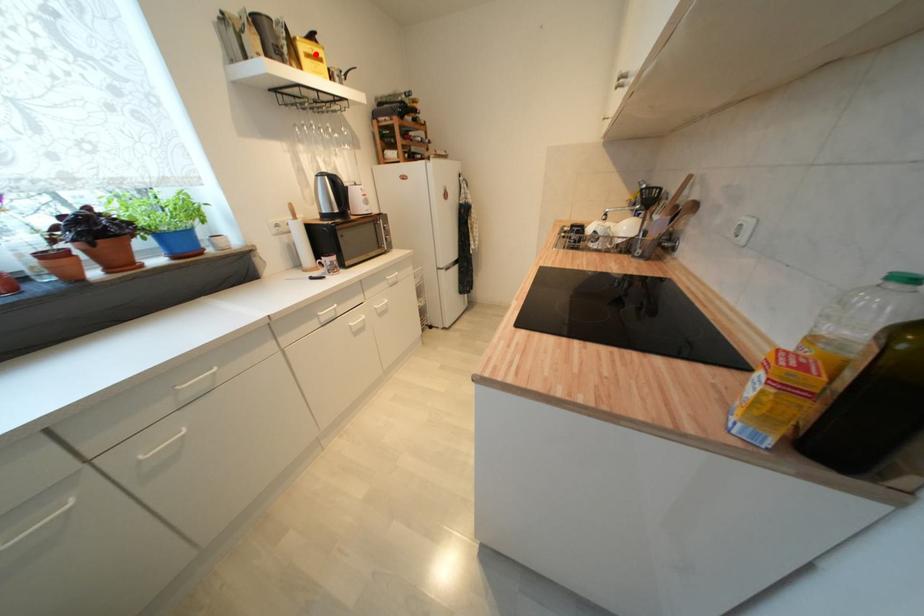
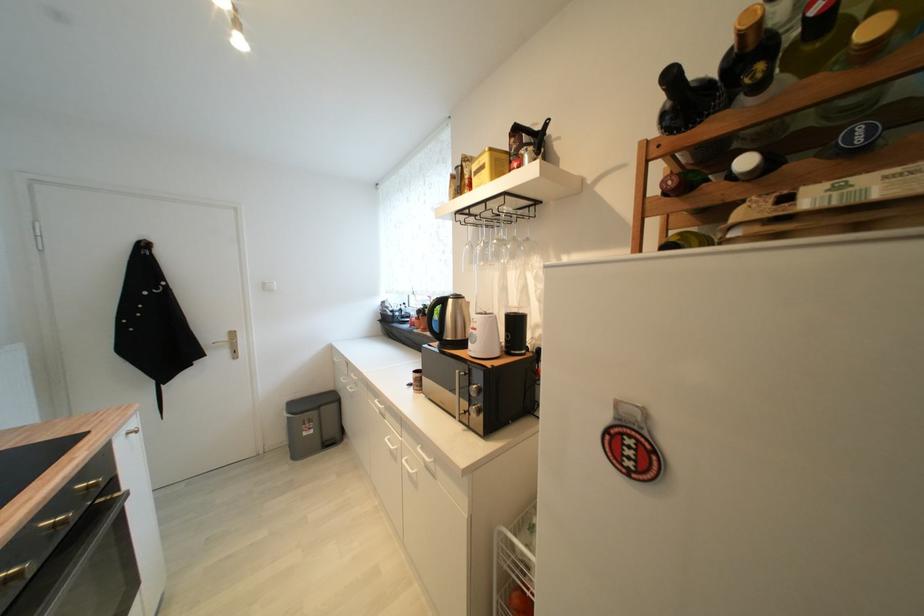
Locate, in the second image, the point that corresponds to the highlighted location in the first image.

(483, 169)